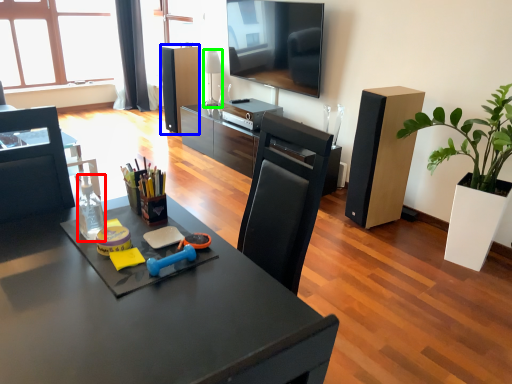
Question: Considering the real-world distances, which object is farthest from bottle (highlighted by a red box)? speaker (highlighted by a blue box) or lamp (highlighted by a green box)?

Choices:
 (A) speaker
 (B) lamp

Answer: (A)